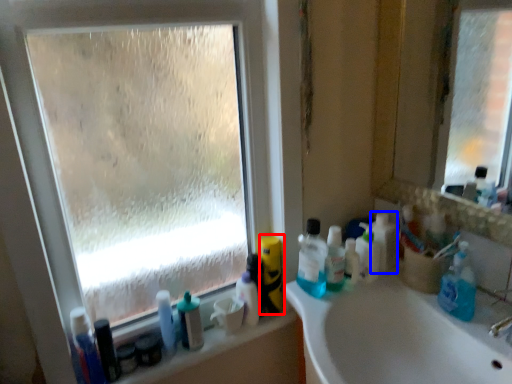
Question: Among these objects, which one is farthest to the camera, cleaning product (highlighted by a red box) or toiletry (highlighted by a blue box)?

Choices:
 (A) cleaning product
 (B) toiletry

Answer: (A)